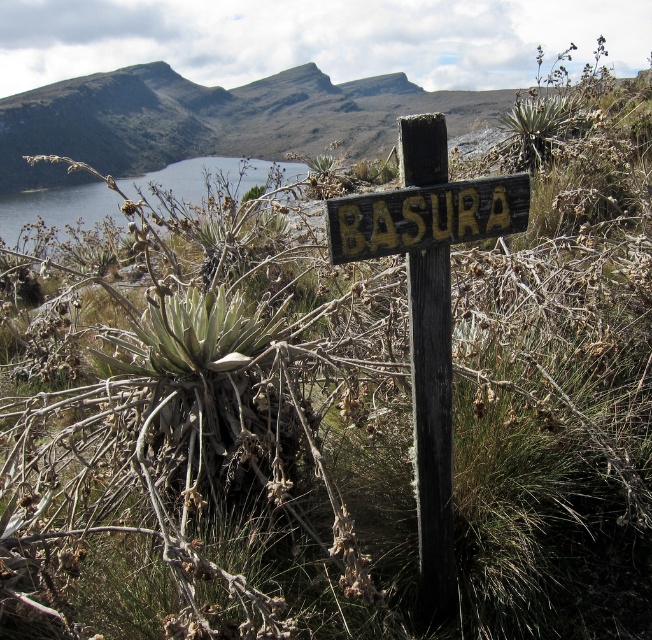
You are a hiker who has reached the wooden sign at center and the yellow painted wood sign at center. Which of these two signs is taller?

The wooden sign at center is taller than the yellow painted wood sign at center.

You are a hiker who needs to place a new sign next to the wooden sign at center and the yellow painted wood sign at center. Which sign should you place your new sign next to if you want it to be more noticeable in size?

You should place your new sign next to the wooden sign at center because it is bigger than the yellow painted wood sign at center, making it more noticeable in size.